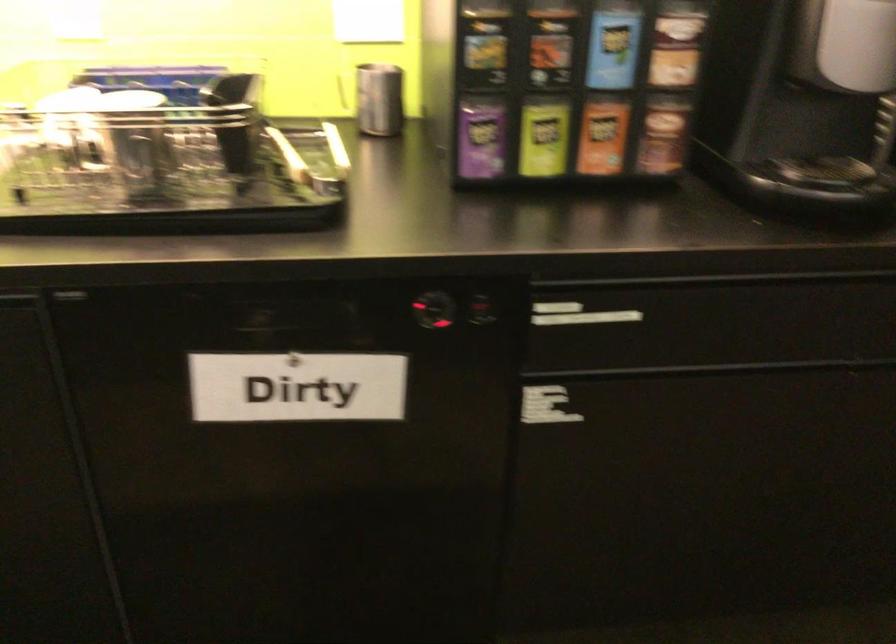
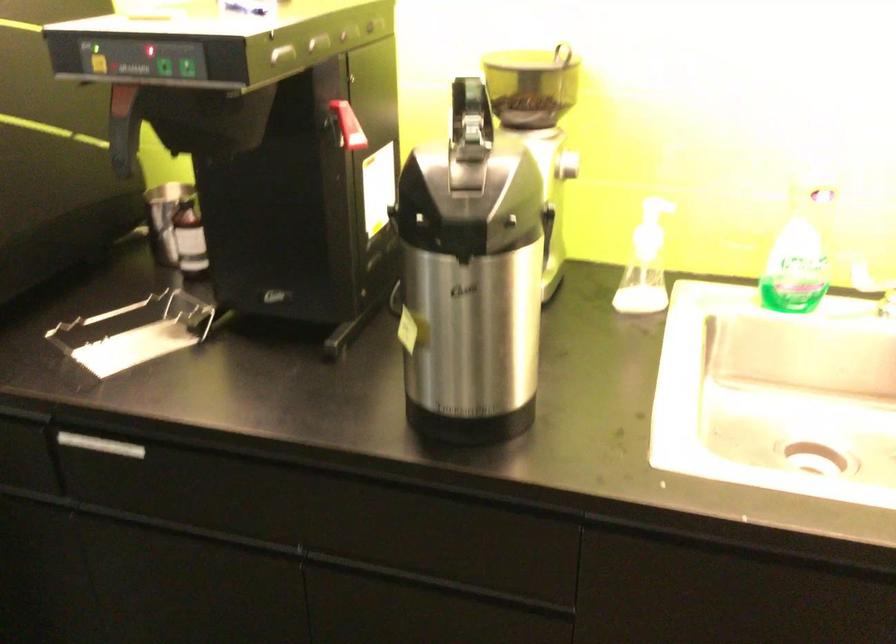
Question: In a continuous first-person perspective shot, in which direction is the camera moving?

Choices:
 (A) Left
 (B) Right
 (C) Forward
 (D) Backward

Answer: (A)